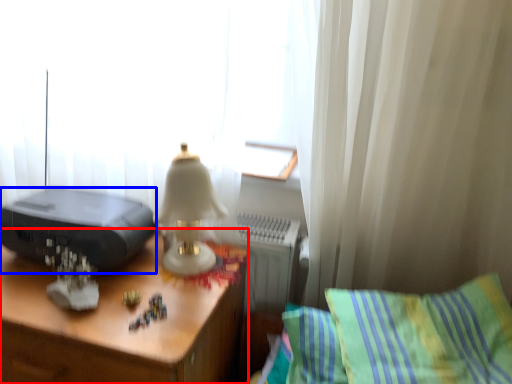
Question: Among these objects, which one is farthest to the camera, desk (highlighted by a red box) or printer (highlighted by a blue box)?

Choices:
 (A) desk
 (B) printer

Answer: (B)